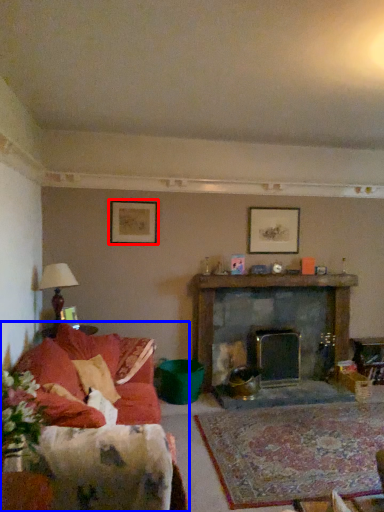
Question: Which object is further to the camera taking this photo, picture frame (highlighted by a red box) or studio couch (highlighted by a blue box)?

Choices:
 (A) picture frame
 (B) studio couch

Answer: (A)